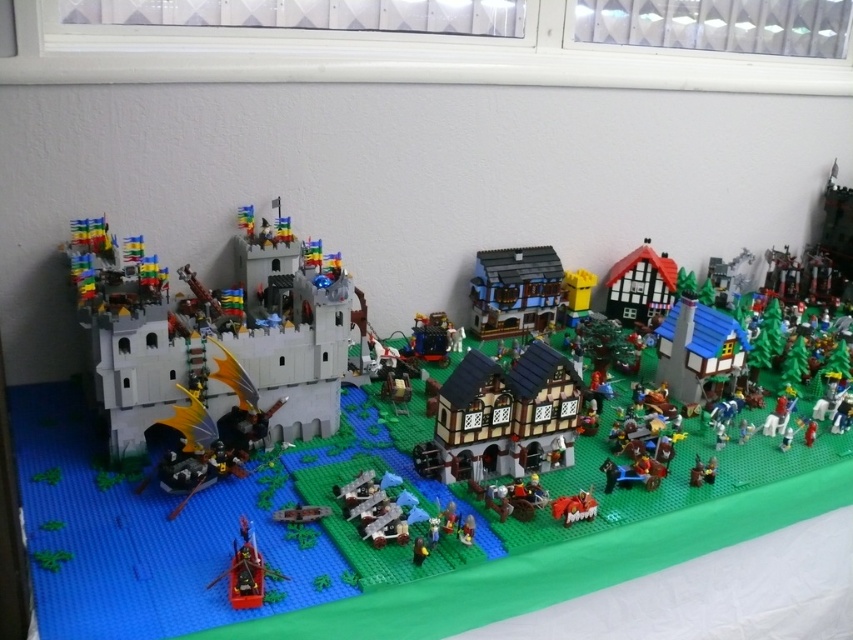
You are a visitor standing in front of the Lego diorama. You notice the white matte castle at left and the wooden house at center. Which of these two structures is positioned lower in the scene?

The white matte castle at left is positioned lower than the wooden house at center in the scene.

You are a tiny Lego figure standing on the table where the diorama is displayed. You want to climb onto the highest point in the scene. Which object should you choose between the white matte castle at left and the wooden house at center?

The white matte castle at left is much taller than the wooden house at center, so you should choose the white matte castle at left to climb onto the highest point.